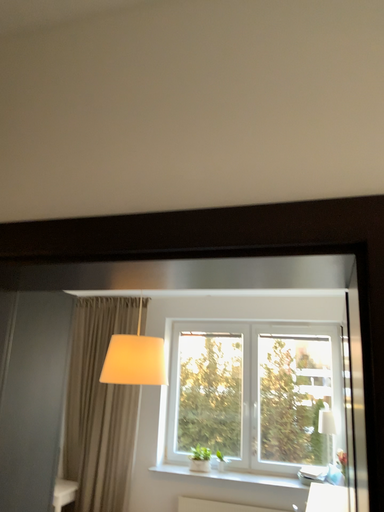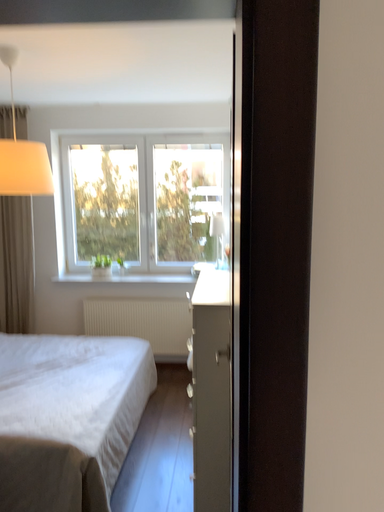
Question: How did the camera likely rotate when shooting the video?

Choices:
 (A) rotated downward
 (B) rotated upward

Answer: (A)